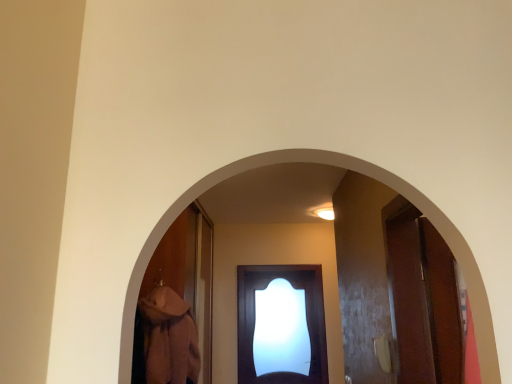
Question: Is the position of matte dark wood door at center less distant than that of white glossy light at upper center?

Choices:
 (A) yes
 (B) no

Answer: (B)

Question: Considering the relative positions of matte dark wood door at center and white glossy light at upper center in the image provided, is matte dark wood door at center to the left of white glossy light at upper center from the viewer's perspective?

Choices:
 (A) yes
 (B) no

Answer: (A)

Question: Is matte dark wood door at center behind white glossy light at upper center?

Choices:
 (A) no
 (B) yes

Answer: (B)

Question: Is matte dark wood door at center oriented away from white glossy light at upper center?

Choices:
 (A) no
 (B) yes

Answer: (A)

Question: Is matte dark wood door at center surrounding white glossy light at upper center?

Choices:
 (A) no
 (B) yes

Answer: (A)

Question: From a real-world perspective, is white glossy light at upper center positioned above or below matte dark wood door at center?

Choices:
 (A) above
 (B) below

Answer: (A)

Question: From the image's perspective, is white glossy light at upper center positioned above or below matte dark wood door at center?

Choices:
 (A) below
 (B) above

Answer: (B)

Question: Would you say white glossy light at upper center is inside or outside matte dark wood door at center?

Choices:
 (A) outside
 (B) inside

Answer: (A)

Question: In terms of width, does white glossy light at upper center look wider or thinner when compared to matte dark wood door at center?

Choices:
 (A) wide
 (B) thin

Answer: (A)

Question: Considering the relative positions of matte dark wood door at center and white glossy light at upper center in the image provided, is matte dark wood door at center to the left or to the right of white glossy light at upper center?

Choices:
 (A) right
 (B) left

Answer: (B)

Question: Is point (318, 306) positioned closer to the camera than point (330, 213)?

Choices:
 (A) closer
 (B) farther

Answer: (B)

Question: In terms of height, does matte dark wood door at center look taller or shorter compared to white glossy light at upper center?

Choices:
 (A) short
 (B) tall

Answer: (B)

Question: Is matte dark wood door at center wider or thinner than white glossy light at upper center?

Choices:
 (A) wide
 (B) thin

Answer: (B)

Question: From a real-world perspective, is smooth wooden archway at center positioned above or below matte dark wood door at center?

Choices:
 (A) above
 (B) below

Answer: (A)

Question: Looking at their shapes, would you say smooth wooden archway at center is wider or thinner than matte dark wood door at center?

Choices:
 (A) wide
 (B) thin

Answer: (B)